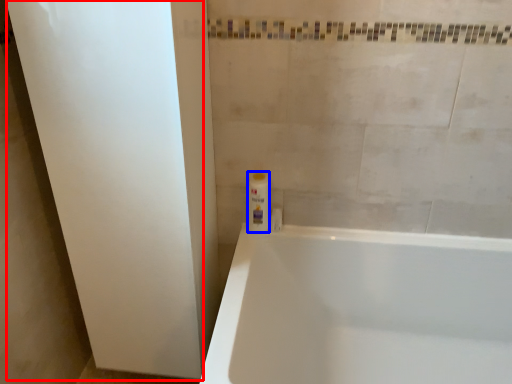
Question: Among these objects, which one is nearest to the camera, screen door (highlighted by a red box) or toiletry (highlighted by a blue box)?

Choices:
 (A) screen door
 (B) toiletry

Answer: (A)